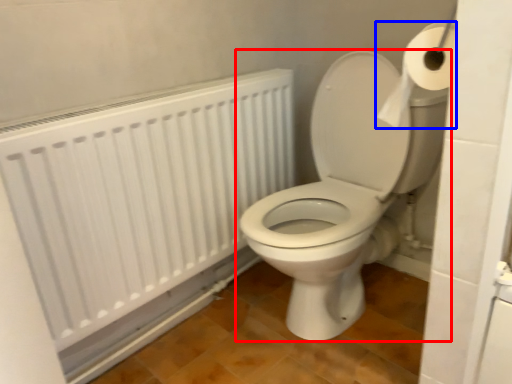
Question: Which point is closer to the camera, toilet (highlighted by a red box) or toilet paper (highlighted by a blue box)?

Choices:
 (A) toilet
 (B) toilet paper

Answer: (B)